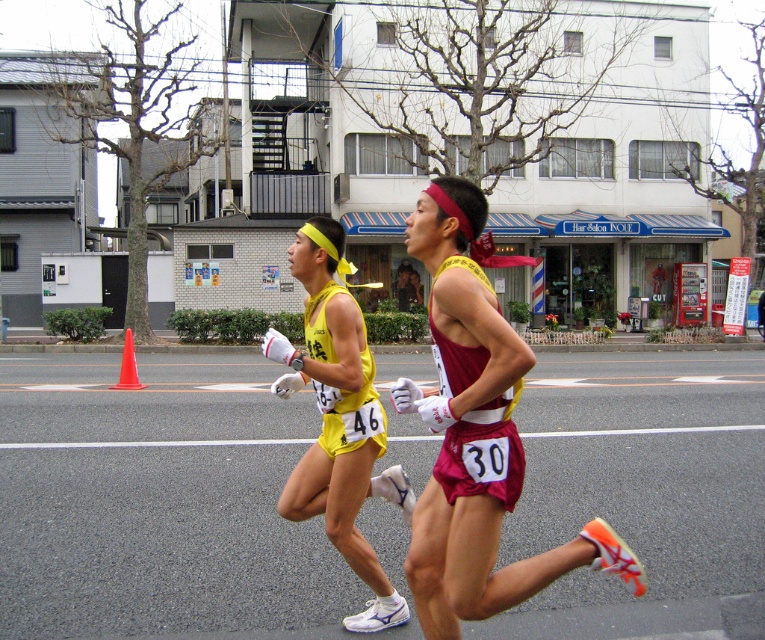
You are a photographer standing at the starting line of the marathon. You want to take a photo that includes both the yellow fabric shorts at center and the orange plastic cone at left. Which object should you focus on first to ensure both are in the frame?

You should focus on the yellow fabric shorts at center first because it is closer to the viewer than the orange plastic cone at left, so adjusting the frame to include it will naturally include the cone as well.

You are a race official at the marathon and need to place a 10 feet wide banner between the yellow fabric shorts at center and the orange plastic cone at left. Is there enough space between them to fit the banner?

The yellow fabric shorts at center and orange plastic cone at left are 33.79 feet apart from each other, so yes, there is enough space between them to fit a 10 feet wide banner.

You are a photographer positioned at the starting line of the marathon. You want to take a photo that includes both the runner in the foreground and the runner in the background. The points you need to consider are point (327,243) and point (132,381). Which point should you focus on to ensure both runners are in sharp focus?

You should focus on point (327,243) because it is closer to the viewer than point (132,381), ensuring both runners are within the depth of field.